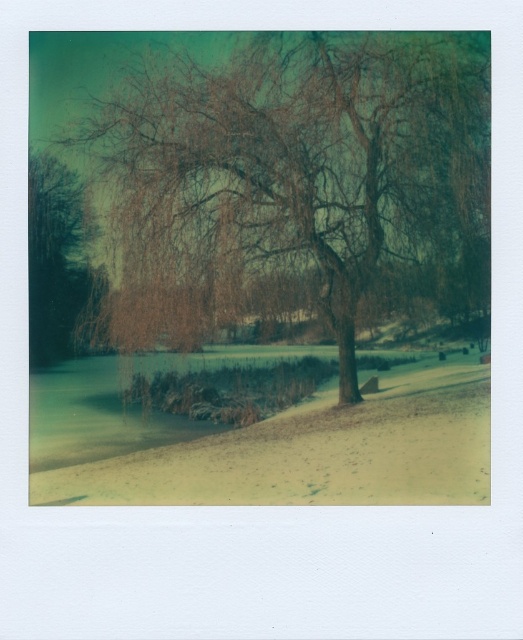
Question: Can you confirm if brown textured tree at center is bigger than brown matte tree at left?

Choices:
 (A) yes
 (B) no

Answer: (A)

Question: Among these objects, which one is farthest from the camera?

Choices:
 (A) brown textured tree at center
 (B) brown matte tree at left

Answer: (B)

Question: Is brown textured tree at center behind brown matte tree at left?

Choices:
 (A) no
 (B) yes

Answer: (A)

Question: Is brown textured tree at center smaller than brown matte tree at left?

Choices:
 (A) no
 (B) yes

Answer: (A)